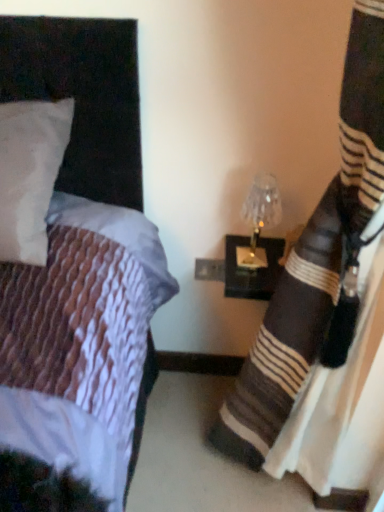
Find the location of a particular element. This screenshot has width=384, height=512. translucent glass lampshade at right is located at coordinates (260, 217).

Describe the element at coordinates (260, 217) in the screenshot. I see `translucent glass lampshade at right` at that location.

Find the location of a particular element. The height and width of the screenshot is (512, 384). black striped fabric at right is located at coordinates (316, 264).

Describe the element at coordinates (316, 264) in the screenshot. I see `black striped fabric at right` at that location.

Locate an element on the screen. translucent glass lampshade at right is located at coordinates (260, 217).

Considering the positions of objects black striped fabric at right and translucent glass lampshade at right in the image provided, who is more to the right, black striped fabric at right or translucent glass lampshade at right?

Positioned to the right is black striped fabric at right.

Between black striped fabric at right and translucent glass lampshade at right, which one is positioned in front?

black striped fabric at right is closer to the camera.

Does point (280, 403) appear closer or farther from the camera than point (276, 184)?

Point (280, 403).

From the image's perspective, which object appears higher, black striped fabric at right or translucent glass lampshade at right?

translucent glass lampshade at right is shown above in the image.

From a real-world perspective, is black striped fabric at right positioned above or below translucent glass lampshade at right?

From a real-world perspective, black striped fabric at right is physically below translucent glass lampshade at right.

Looking at their sizes, would you say black striped fabric at right is wider or thinner than translucent glass lampshade at right?

Considering their sizes, black striped fabric at right looks broader than translucent glass lampshade at right.

Who is taller, black striped fabric at right or translucent glass lampshade at right?

With more height is black striped fabric at right.

Is black striped fabric at right smaller than translucent glass lampshade at right?

Actually, black striped fabric at right might be larger than translucent glass lampshade at right.

Do you think black striped fabric at right is within translucent glass lampshade at right, or outside of it?

The correct answer is: outside.

Is black striped fabric at right next to translucent glass lampshade at right?

black striped fabric at right and translucent glass lampshade at right are not in contact.

Is black striped fabric at right facing away from translucent glass lampshade at right?

No, black striped fabric at right is not facing the opposite direction of translucent glass lampshade at right.

How distant is black striped fabric at right from translucent glass lampshade at right?

black striped fabric at right is 14.98 inches from translucent glass lampshade at right.

Where is `curtain below the translucent glass lampshade at right (from a real-world perspective)`? curtain below the translucent glass lampshade at right (from a real-world perspective) is located at coordinates (316, 264).

Which is more to the left, translucent glass lampshade at right or black striped fabric at right?

Positioned to the left is translucent glass lampshade at right.

Which is behind, translucent glass lampshade at right or black striped fabric at right?

translucent glass lampshade at right.

Is point (273, 189) closer or farther from the camera than point (350, 189)?

Point (273, 189).

From the image's perspective, which one is positioned higher, translucent glass lampshade at right or black striped fabric at right?

translucent glass lampshade at right.

From a real-world perspective, between translucent glass lampshade at right and black striped fabric at right, who is vertically lower?

In real-world perspective, black striped fabric at right is lower.

Which object is thinner, translucent glass lampshade at right or black striped fabric at right?

With smaller width is translucent glass lampshade at right.

Considering the relative sizes of translucent glass lampshade at right and black striped fabric at right in the image provided, is translucent glass lampshade at right taller than black striped fabric at right?

No, translucent glass lampshade at right is not taller than black striped fabric at right.

Can you confirm if translucent glass lampshade at right is bigger than black striped fabric at right?

Actually, translucent glass lampshade at right might be smaller than black striped fabric at right.

Is translucent glass lampshade at right not within black striped fabric at right?

translucent glass lampshade at right lies outside black striped fabric at right's area.

Would you say translucent glass lampshade at right is a long distance from black striped fabric at right?

They are positioned close to each other.

Is translucent glass lampshade at right aimed at black striped fabric at right?

Yes, translucent glass lampshade at right is facing black striped fabric at right.

How different are the orientations of translucent glass lampshade at right and black striped fabric at right in degrees?

The angle between the facing direction of translucent glass lampshade at right and the facing direction of black striped fabric at right is 84.8 degrees.

How much distance is there between translucent glass lampshade at right and black striped fabric at right?

translucent glass lampshade at right is 14.98 inches away from black striped fabric at right.

Where is `curtain below the translucent glass lampshade at right (from a real-world perspective)`? curtain below the translucent glass lampshade at right (from a real-world perspective) is located at coordinates (316, 264).

Find the location of `curtain in front of the translucent glass lampshade at right`. curtain in front of the translucent glass lampshade at right is located at coordinates (316, 264).

Locate an element on the screen. The height and width of the screenshot is (512, 384). curtain below the translucent glass lampshade at right (from the image's perspective) is located at coordinates (316, 264).